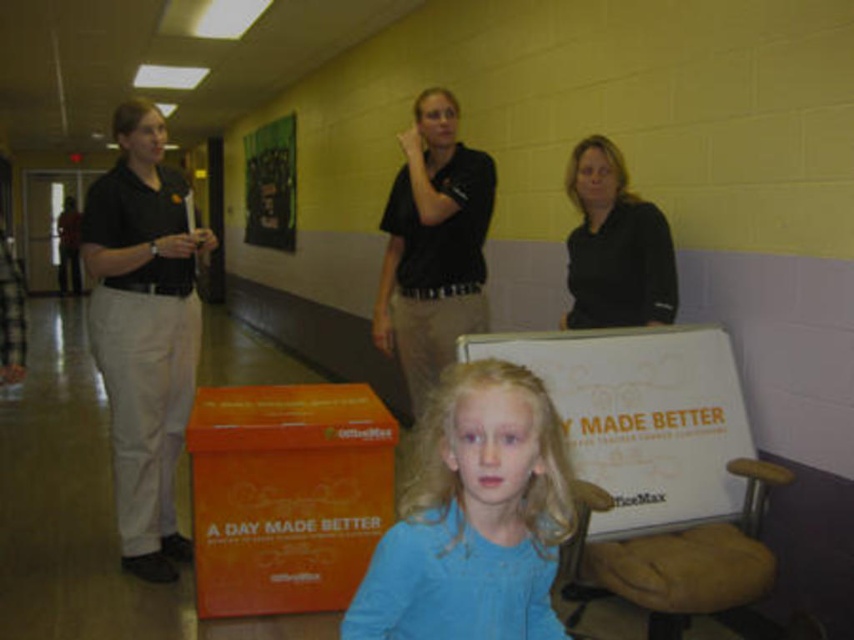
Question: Which object appears farthest from the camera in this image?

Choices:
 (A) black matte shirt at upper center
 (B) matte black shirt at left

Answer: (B)

Question: Among these objects, which one is farthest from the camera?

Choices:
 (A) orange matte cardboard box at lower left
 (B) black matte shirt at upper center
 (C) black matte shirt at center

Answer: (C)

Question: Does matte black shirt at left have a smaller size compared to black matte shirt at upper center?

Choices:
 (A) yes
 (B) no

Answer: (B)

Question: Does orange matte cardboard box at lower left come behind matte black shirt at left?

Choices:
 (A) yes
 (B) no

Answer: (B)

Question: Which of the following is the farthest from the observer?

Choices:
 (A) blue fabric shirt at center
 (B) orange matte cardboard box at lower left

Answer: (B)

Question: Can you confirm if orange matte cardboard box at lower left is smaller than black matte shirt at center?

Choices:
 (A) yes
 (B) no

Answer: (A)